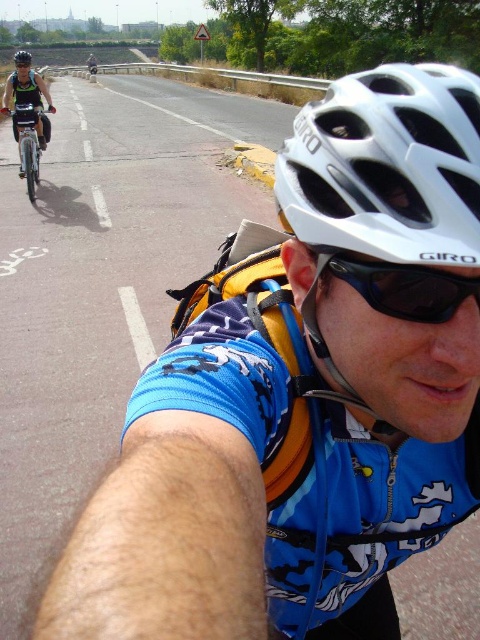
You are a cyclist approaching a road with two cyclists ahead. You see a matte black helmet at upper center represented by point (25, 88) and a cyclist in blue jersey with white animals on the left. Which cyclist is closer to you?

The matte black helmet at upper center represented by point (25, 88) is closer to you because it is positioned at the upper center, indicating it is in the foreground compared to the cyclist in blue jersey with white animals on the left who is further back.

You are a delivery drone operator. Your drone needs to fly from the black plastic sunglasses at center to the matte black bicycle at upper left. What is the minimum distance your drone must cover to reach the destination?

The minimum distance the drone must cover is 174.39 feet to reach from the black plastic sunglasses at center to the matte black bicycle at upper left.